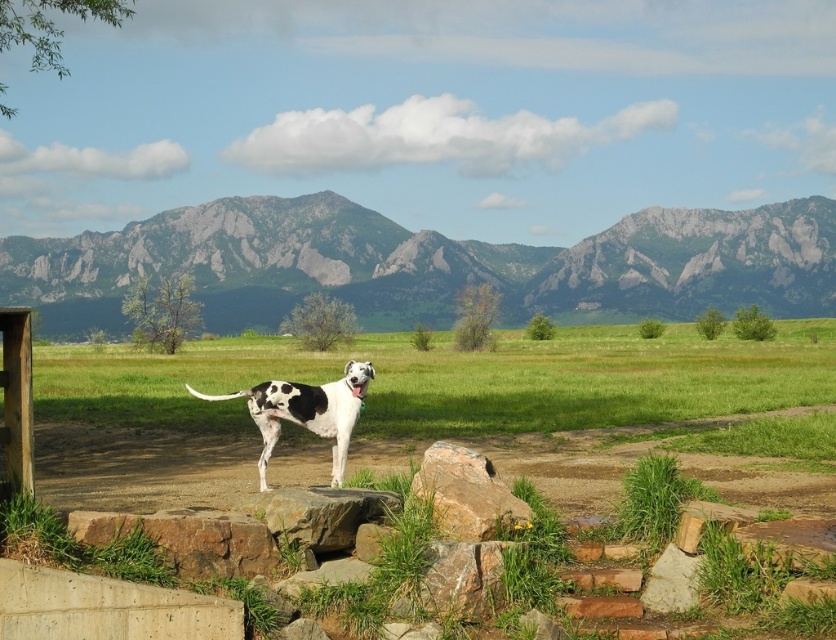
Question: Is gray rocky mountain at upper center wider than gray rock at lower right?

Choices:
 (A) yes
 (B) no

Answer: (A)

Question: Which of the following is the closest to the observer?

Choices:
 (A) (283, 314)
 (B) (645, 584)

Answer: (B)

Question: Is brown rough stone at lower center below brown rough rock at center?

Choices:
 (A) no
 (B) yes

Answer: (B)

Question: Which point is closer to the camera?

Choices:
 (A) rusty stone at center
 (B) white/black spotted dog at center

Answer: (A)

Question: Which point is closer to the camera taking this photo?

Choices:
 (A) (383, 493)
 (B) (192, 573)
 (C) (330, 468)
 (D) (441, 460)

Answer: (B)

Question: Does gray rocky mountain at upper center appear on the left side of brown rough stone at lower center?

Choices:
 (A) no
 (B) yes

Answer: (A)